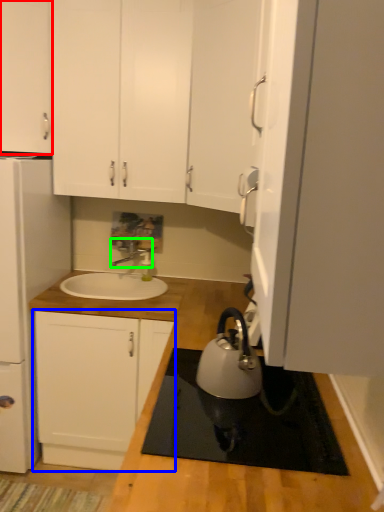
Question: Which object is the closest to the cabinetry (highlighted by a red box)? Choose among these: cabinetry (highlighted by a blue box) or tap (highlighted by a green box).

Choices:
 (A) cabinetry
 (B) tap

Answer: (B)